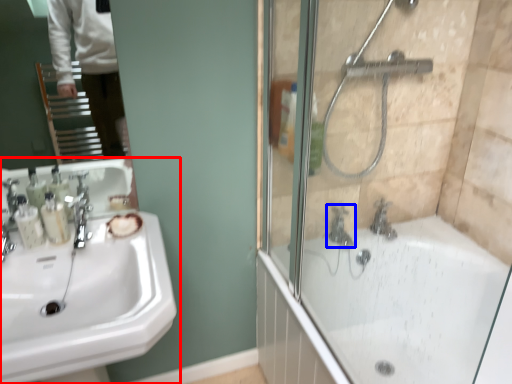
Question: Which point is further to the camera, sink (highlighted by a red box) or tap (highlighted by a blue box)?

Choices:
 (A) sink
 (B) tap

Answer: (B)